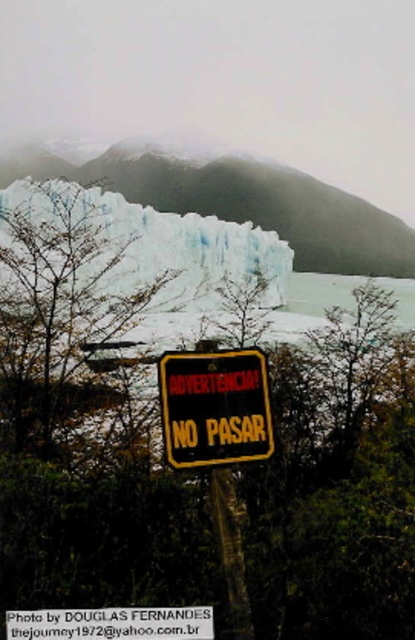
You are a hiker standing at the signpost with yellow border and black background in the image. You want to reach the white ice glacier at upper center. According to the coordinates provided, which direction should you move to get closer to the glacier?

The white ice glacier at upper center is located at coordinates point (248, 204). Since you are at the signpost in the foreground, you should move towards the upper center direction to reach the glacier.